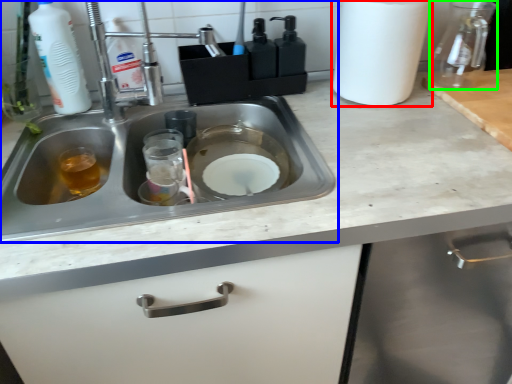
Question: Estimate the real-world distances between objects in this image. Which object is farther from paper towel (highlighted by a red box), sink (highlighted by a blue box) or glass jar (highlighted by a green box)?

Choices:
 (A) sink
 (B) glass jar

Answer: (A)